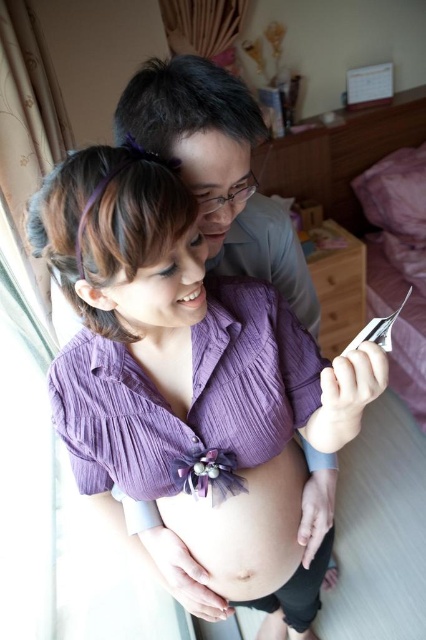
Is point (111, 444) positioned after point (288, 563)?

No.

Which is behind, point (86, 289) or point (293, 504)?

The point (293, 504) is more distant.

Between point (279, 336) and point (247, 506), which one is positioned in front?

Point (279, 336) is in front.

The height and width of the screenshot is (640, 426). What are the coordinates of `purple crinkled blouse at center` in the screenshot? It's located at (176, 324).